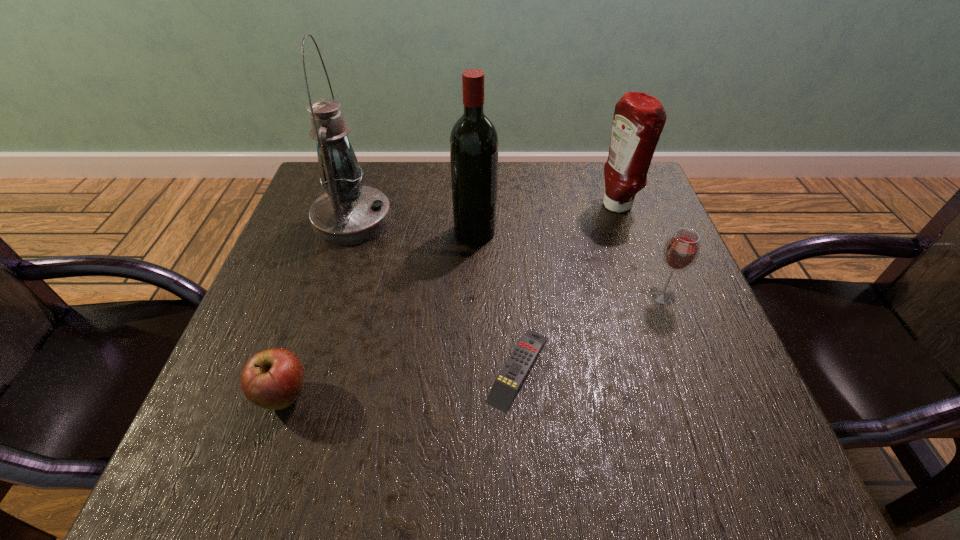
Find the location of a particular element. free point that satisfies the following two spatial constraints: 1. on the back side of the second shortest object; 2. on the left side of the shortest object is located at coordinates (294, 368).

You are a GUI agent. You are given a task and a screenshot of the screen. Output one action in this format:
    pyautogui.click(x=<x>, y=<y>)
    Task: Click on the free location that satisfies the following two spatial constraints: 1. on the back side of the fifth tallest object; 2. on the right side of the fourth shortest object
    
    Given the screenshot: What is the action you would take?
    pyautogui.click(x=349, y=206)